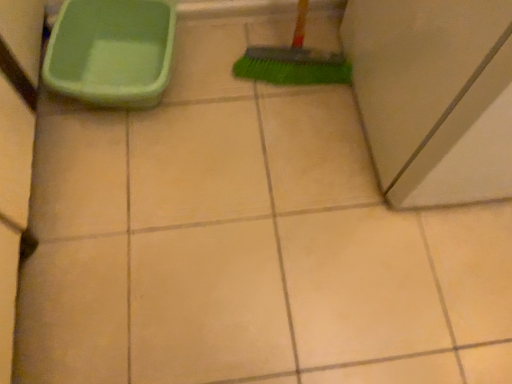
Identify the location of free space that is in between matte gray cabinet at right and green plastic bucket at upper left. (259, 111).